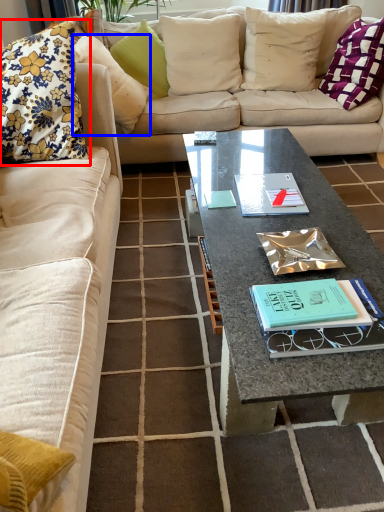
Question: Which point is closer to the camera, pillow (highlighted by a red box) or pillow (highlighted by a blue box)?

Choices:
 (A) pillow
 (B) pillow

Answer: (A)